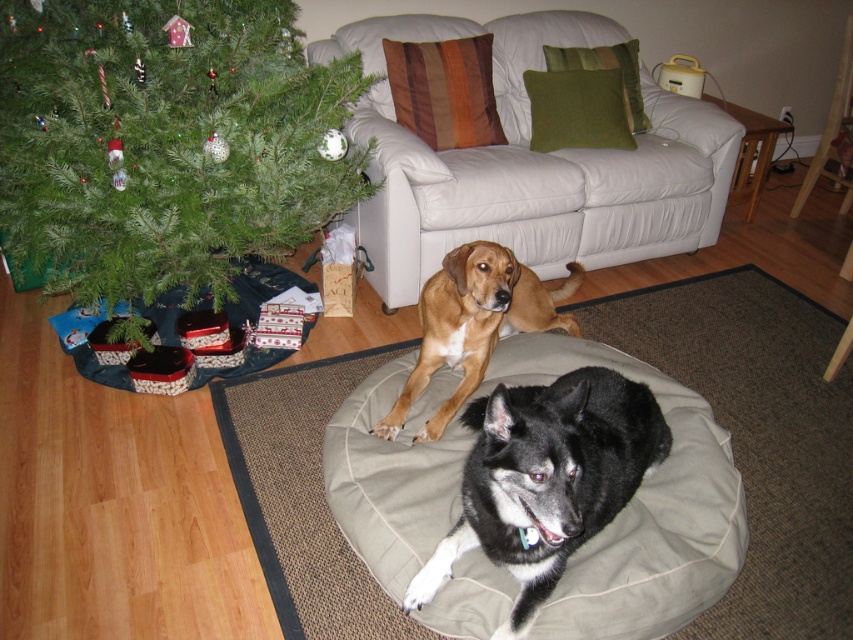
Question: Does striped fabric pillow at upper center have a larger size compared to green textured pillow at upper center?

Choices:
 (A) no
 (B) yes

Answer: (B)

Question: Which object is closer to the camera taking this photo?

Choices:
 (A) brown furry dog at center
 (B) green fabric pillow at upper center
 (C) striped fabric pillow at upper center
 (D) white leather couch at upper center

Answer: (A)

Question: Does green matte christmas tree at lower left have a smaller size compared to green fabric pillow at upper center?

Choices:
 (A) yes
 (B) no

Answer: (B)

Question: Which point appears closest to the camera in this image?

Choices:
 (A) (602, 52)
 (B) (544, 435)
 (C) (627, 122)
 (D) (291, 113)

Answer: (B)

Question: Is brown furry dog at center behind striped fabric pillow at upper center?

Choices:
 (A) no
 (B) yes

Answer: (A)

Question: Estimate the real-world distances between objects in this image. Which object is closer to the green fabric pillow at upper center?

Choices:
 (A) black fur dog at center
 (B) green textured pillow at upper center
 (C) brown furry dog at center
 (D) striped fabric pillow at upper center

Answer: (B)